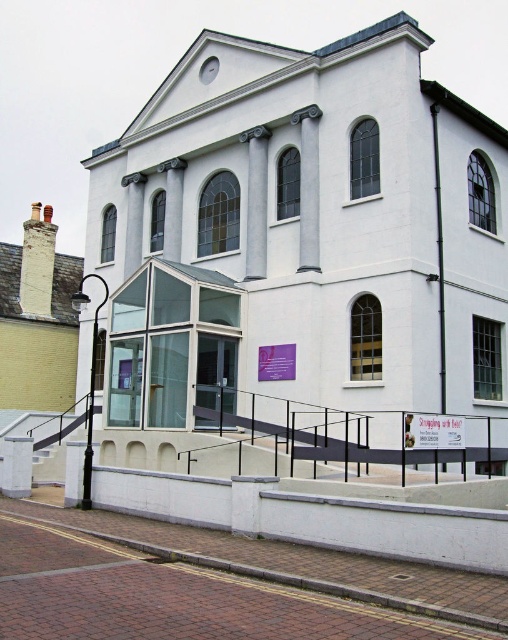
You are an architect evaluating the building. You need to determine which of the two structures, the white smooth chapel at center or the yellow brick chimney at upper left, has a narrower width. Which one is it?

The white smooth chapel at center is thinner than the yellow brick chimney at upper left, so the white smooth chapel at center has a narrower width.

You are standing in front of the two story classical building and want to take a photo. You notice two points marked in the scene. The first point is at coordinate point (264, 220) and the second is at point (73, 312). Which point will appear larger in your photo?

Point (264, 220) is closer to the camera than point (73, 312), so it will appear larger in the photo.